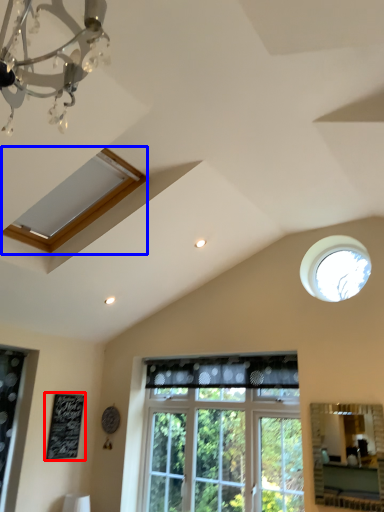
Question: Among these objects, which one is farthest to the camera, bulletin board (highlighted by a red box) or window (highlighted by a blue box)?

Choices:
 (A) bulletin board
 (B) window

Answer: (A)